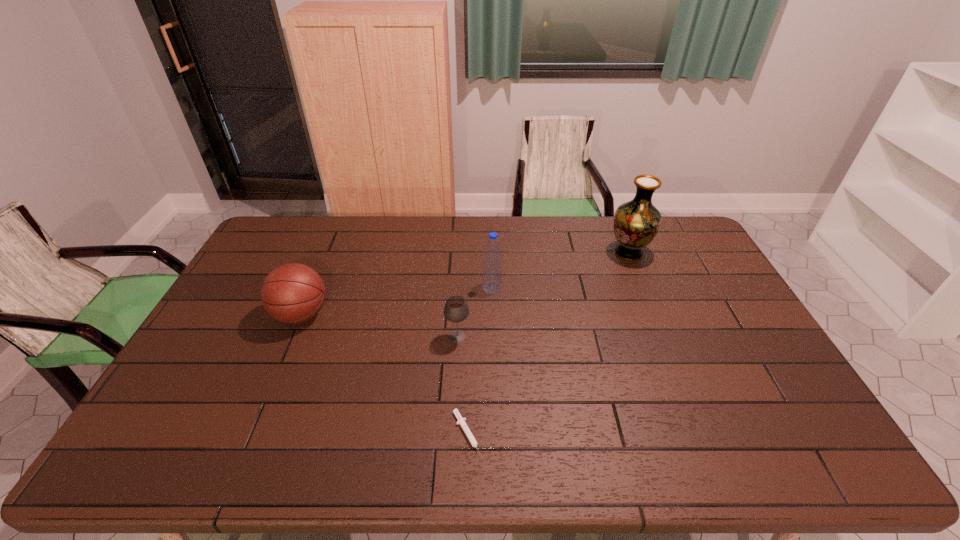
Select which object appears as the second closest to the vase. Please provide its 2D coordinates. Your answer should be formatted as a tuple, i.e. [(x, y)], where the tuple contains the x and y coordinates of a point satisfying the conditions above.

[(456, 309)]

The image size is (960, 540). Identify the location of object that is the fourth closest to the basketball. (636, 223).

In order to click on free spot that satisfies the following two spatial constraints: 1. on the back side of the basketball; 2. on the right side of the fourth shortest object in this screenshot , I will do `click(313, 287)`.

At what (x,y) coordinates should I click in order to perform the action: click on free spot that satisfies the following two spatial constraints: 1. on the back side of the water bottle; 2. on the left side of the shortest object. Please return your answer as a coordinate pair (x, y). Image resolution: width=960 pixels, height=540 pixels. Looking at the image, I should click on (471, 287).